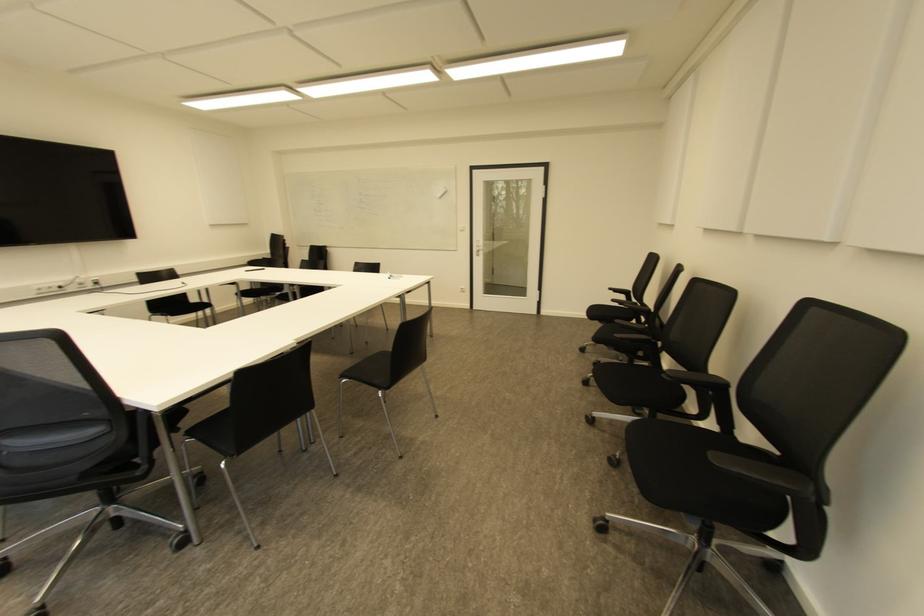
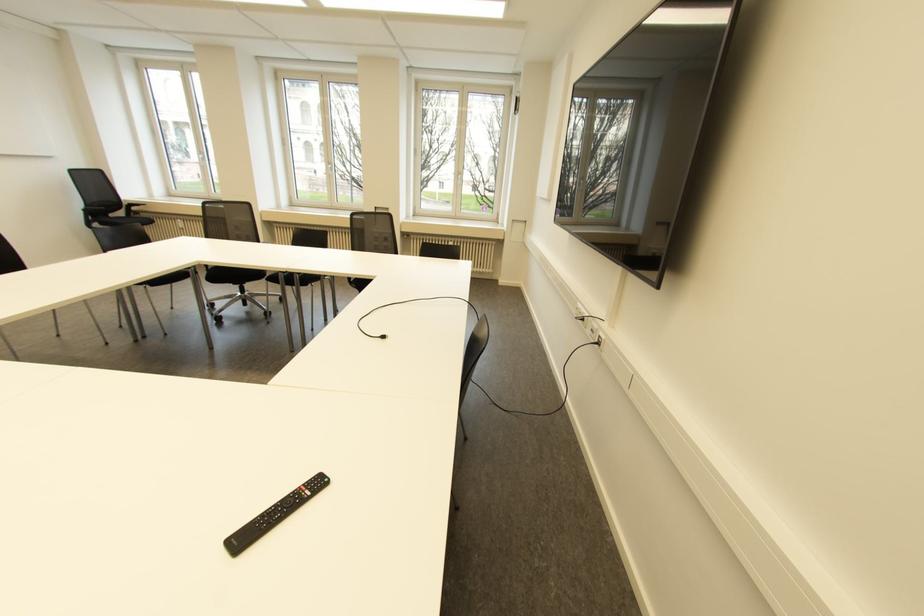
Locate, in the second image, the point that corresponds to pixel 96 282 in the first image.

(598, 342)